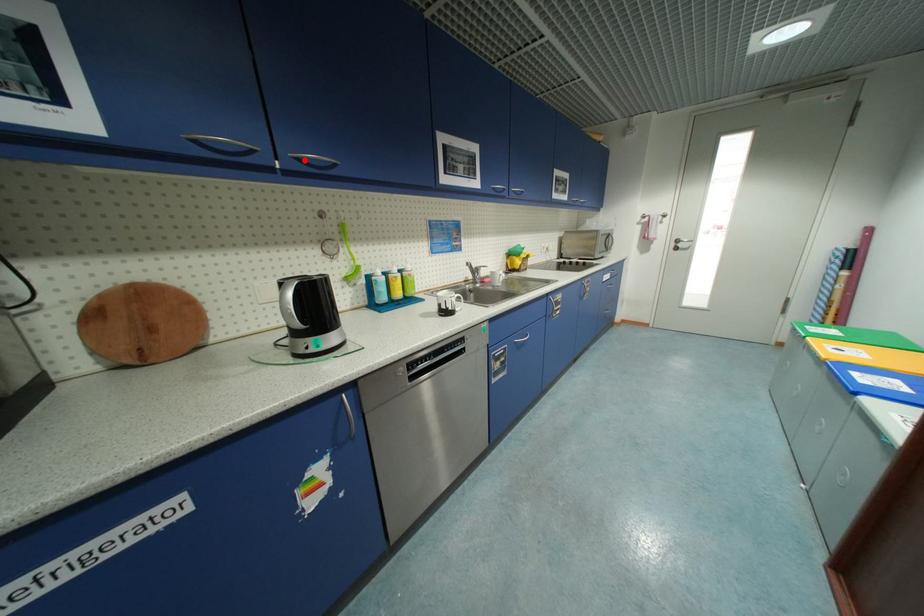
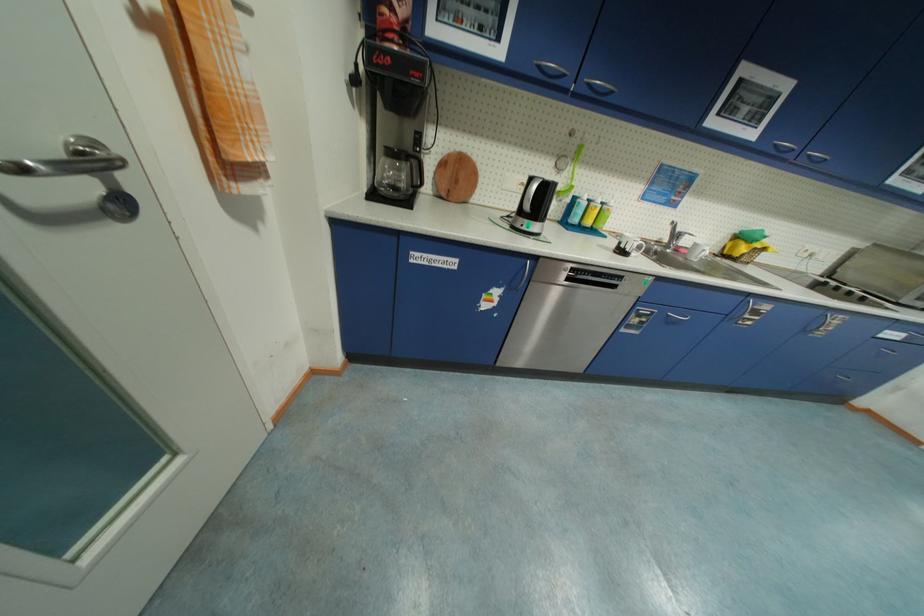
Find the pixel in the second image that matches the highlighted location in the first image.

(594, 86)